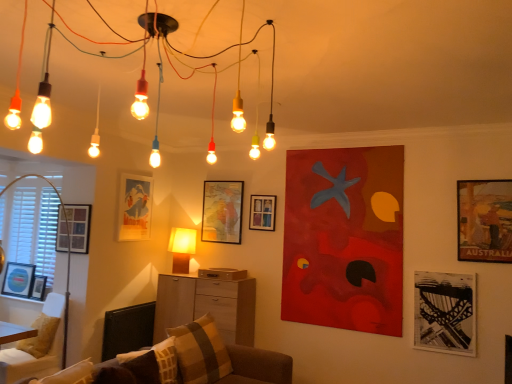
The image size is (512, 384). Find the location of `matte blue picture frame at left, the first picture frame when ordered from left to right`. matte blue picture frame at left, the first picture frame when ordered from left to right is located at coordinates coord(18,280).

What is the approximate height of matte paper picture frame at upper left, which is counted as the fifth picture frame, starting from the right?

matte paper picture frame at upper left, which is counted as the fifth picture frame, starting from the right, is 29.89 inches tall.

At what (x,y) coordinates should I click in order to perform the action: click on matte blue picture frame at left, the first picture frame when ordered from left to right. Please return your answer as a coordinate pair (x, y). Looking at the image, I should click on (18, 280).

Consider the image. Visually, is brown textured pillow at lower center, the second pillow positioned from the back, positioned to the left or to the right of wooden drawer at center?

Based on their positions, brown textured pillow at lower center, the second pillow positioned from the back, is located to the left of wooden drawer at center.

Is brown textured pillow at lower center, acting as the 1th pillow starting from the front, oriented away from wooden drawer at center?

No, brown textured pillow at lower center, acting as the 1th pillow starting from the front, is not facing away from wooden drawer at center.

Considering the points (150, 381) and (200, 273), which point is in front, point (150, 381) or point (200, 273)?

Positioned in front is point (150, 381).

Does point (277, 370) lie behind point (4, 369)?

Yes, it is.

Considering the relative sizes of plush brown couch at lower center and light brown fabric sofa at lower left in the image provided, is plush brown couch at lower center taller than light brown fabric sofa at lower left?

Correct, plush brown couch at lower center is much taller as light brown fabric sofa at lower left.

Is plush brown couch at lower center positioned with its back to light brown fabric sofa at lower left?

Correct, plush brown couch at lower center is looking away from light brown fabric sofa at lower left.

Which of these two, matte black picture frame at left, which appears as the second picture frame when viewed from the left, or wooden textured poster at upper right, the 1th picture frame in the right-to-left sequence, is thinner?

Thinner between the two is matte black picture frame at left, which appears as the second picture frame when viewed from the left.

Are matte black picture frame at left, which appears as the second picture frame when viewed from the left, and wooden textured poster at upper right, the 1th picture frame in the right-to-left sequence, beside each other?

No, matte black picture frame at left, which appears as the second picture frame when viewed from the left, is not making contact with wooden textured poster at upper right, the 1th picture frame in the right-to-left sequence.

How far apart are matte black picture frame at left, the 7th picture frame positioned from the right, and wooden textured poster at upper right, the 1th picture frame in the right-to-left sequence?

matte black picture frame at left, the 7th picture frame positioned from the right, and wooden textured poster at upper right, the 1th picture frame in the right-to-left sequence, are 14.14 feet apart from each other.

From a real-world perspective, is wooden picture frame at left, the 6th picture frame viewed from the right, below wooden drawer at center?

Incorrect, from a real-world perspective, wooden picture frame at left, the 6th picture frame viewed from the right, is higher than wooden drawer at center.

In terms of size, does wooden picture frame at left, the 6th picture frame viewed from the right, appear bigger or smaller than wooden drawer at center?

In the image, wooden picture frame at left, the 6th picture frame viewed from the right, appears to be smaller than wooden drawer at center.

How many degrees apart are the facing directions of wooden picture frame at left, the 6th picture frame viewed from the right, and wooden drawer at center?

wooden picture frame at left, the 6th picture frame viewed from the right, and wooden drawer at center are facing 1.71 degrees away from each other.

Considering the points (31, 297) and (60, 212), which point is in front, point (31, 297) or point (60, 212)?

The point (31, 297) is closer.

Is matte black picture frame at left, which appears as the second picture frame when viewed from the left, thinner than wooden picture frame at left, the 6th picture frame viewed from the right?

In fact, matte black picture frame at left, which appears as the second picture frame when viewed from the left, might be wider than wooden picture frame at left, the 6th picture frame viewed from the right.

From a real-world perspective, between matte black picture frame at left, which appears as the second picture frame when viewed from the left, and wooden picture frame at left, acting as the third picture frame starting from the left, who is vertically higher?

From a 3D spatial view, wooden picture frame at left, acting as the third picture frame starting from the left, is above.

From the image's perspective, is matte black picture frame at left, the 7th picture frame positioned from the right, below wooden picture frame at left, the 6th picture frame viewed from the right?

Yes.

Which is behind, point (13, 371) or point (194, 281)?

The point (194, 281) is farther from the camera.

Is light brown fabric sofa at lower left closer to camera compared to wooden cabinet at center?

That is True.

Identify the location of dresser above the light brown fabric sofa at lower left (from a real-world perspective). (206, 305).

Is wooden drawer at center in front of or behind plaid fabric pillow at lower center, arranged as the 2th pillow when viewed from the front, in the image?

Clearly, wooden drawer at center is behind plaid fabric pillow at lower center, arranged as the 2th pillow when viewed from the front.

Could you tell me if wooden drawer at center is turned towards plaid fabric pillow at lower center, which ranks as the first pillow in back-to-front order?

No, wooden drawer at center is not oriented towards plaid fabric pillow at lower center, which ranks as the first pillow in back-to-front order.

Does wooden drawer at center have a greater height compared to plaid fabric pillow at lower center, which ranks as the first pillow in back-to-front order?

In fact, wooden drawer at center may be shorter than plaid fabric pillow at lower center, which ranks as the first pillow in back-to-front order.

Does wooden drawer at center have a smaller size compared to plaid fabric pillow at lower center, arranged as the 2th pillow when viewed from the front?

Correct, wooden drawer at center occupies less space than plaid fabric pillow at lower center, arranged as the 2th pillow when viewed from the front.

Find the location of a particular element. This screenshot has width=512, height=384. drawer on the right of brown textured pillow at lower center, the second pillow positioned from the back is located at coordinates (222, 273).

Where is `furniture lying above the plush brown couch at lower center (from the image's perspective)`? Image resolution: width=512 pixels, height=384 pixels. furniture lying above the plush brown couch at lower center (from the image's perspective) is located at coordinates (33, 355).

Based on their spatial positions, is brown textured pillow at lower center, the second pillow positioned from the back, or wooden drawer at center further from wooden picture frame at left, the 6th picture frame viewed from the right?

Among the two, brown textured pillow at lower center, the second pillow positioned from the back, is located further to wooden picture frame at left, the 6th picture frame viewed from the right.

Based on their spatial positions, is plush brown couch at lower center or wooden picture frame at left, the 6th picture frame viewed from the right, closer to matte black picture frame at left, which appears as the second picture frame when viewed from the left?

wooden picture frame at left, the 6th picture frame viewed from the right, is closer to matte black picture frame at left, which appears as the second picture frame when viewed from the left.

Based on their spatial positions, is light brown fabric sofa at lower left or matte yellow plastic lamp at center closer to white matte window screen at left?

The object closer to white matte window screen at left is light brown fabric sofa at lower left.

Based on their spatial positions, is matte glass lightbulbs at upper center or plaid fabric pillow at lower center, arranged as the 2th pillow when viewed from the front, closer to black matte picture frame at lower right, the 7th picture frame from the left?

Among the two, plaid fabric pillow at lower center, arranged as the 2th pillow when viewed from the front, is located nearer to black matte picture frame at lower right, the 7th picture frame from the left.

Which object lies nearer to the anchor point wooden map at center, placed as the fifth picture frame when sorted from left to right, brown textured pillow at lower center, the second pillow positioned from the back, or wooden textured poster at upper right, the 1th picture frame in the right-to-left sequence?

brown textured pillow at lower center, the second pillow positioned from the back, lies closer to wooden map at center, placed as the fifth picture frame when sorted from left to right, than the other object.

Looking at the image, which one is located further to wooden map at center, the 4th picture frame when ordered from right to left, matte blue picture frame at left, the 8th picture frame positioned from the right, or plush brown couch at lower center?

Among the two, matte blue picture frame at left, the 8th picture frame positioned from the right, is located further to wooden map at center, the 4th picture frame when ordered from right to left.

Consider the image. Looking at the image, which one is located further to wooden map at center, placed as the fifth picture frame when sorted from left to right, matte glass lightbulbs at upper center or wooden drawer at center?

Based on the image, matte glass lightbulbs at upper center appears to be further to wooden map at center, placed as the fifth picture frame when sorted from left to right.

When comparing their distances from matte blue picture frame at left, the first picture frame when ordered from left to right, does wooden picture frame at center, the third picture frame viewed from the right, or plaid fabric pillow at lower center, arranged as the 2th pillow when viewed from the front, seem closer?

plaid fabric pillow at lower center, arranged as the 2th pillow when viewed from the front, is closer to matte blue picture frame at left, the first picture frame when ordered from left to right.

The width and height of the screenshot is (512, 384). What are the coordinates of `window screen between matte glass lightbulbs at upper center and wooden map at center, placed as the fifth picture frame when sorted from left to right, along the z-axis` in the screenshot? It's located at (31, 222).

Locate an element on the screen. This screenshot has height=384, width=512. furniture between matte blue picture frame at left, the first picture frame when ordered from left to right, and wooden textured poster at upper right, the 1th picture frame in the right-to-left sequence, from left to right is located at coordinates (33, 355).

Image resolution: width=512 pixels, height=384 pixels. Find the location of `lamp between matte blue picture frame at left, the 8th picture frame positioned from the right, and wooden picture frame at center, the third picture frame viewed from the right, from left to right`. lamp between matte blue picture frame at left, the 8th picture frame positioned from the right, and wooden picture frame at center, the third picture frame viewed from the right, from left to right is located at coordinates 182,248.

You are a GUI agent. You are given a task and a screenshot of the screen. Output one action in this format:
    pyautogui.click(x=<x>, y=<y>)
    Task: Click on the dresser located between matte blue picture frame at left, the 8th picture frame positioned from the right, and wooden map at center, placed as the fifth picture frame when sorted from left to right, in the left-right direction
    The height and width of the screenshot is (384, 512).
    Given the screenshot: What is the action you would take?
    pyautogui.click(x=206, y=305)